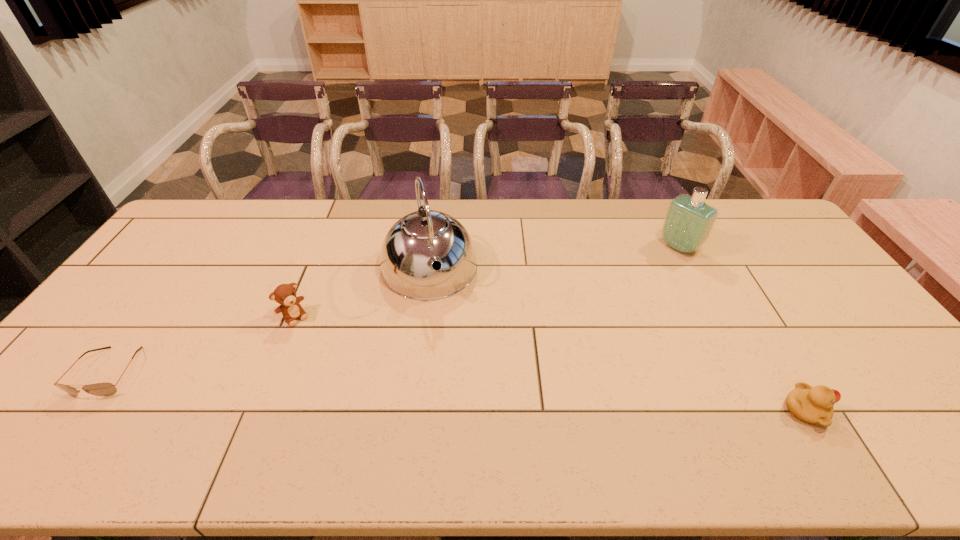
In order to click on free spot on the desktop that is between the shortest object and the second shortest object and is positioned from the spout of the tallest object in this screenshot , I will do `click(464, 392)`.

Find the location of `free spot on the desktop that is between the shortest object and the second shortest object and is positioned on the front label of the perfume`. free spot on the desktop that is between the shortest object and the second shortest object and is positioned on the front label of the perfume is located at coordinates (481, 393).

This screenshot has width=960, height=540. What are the coordinates of `free space on the desktop that is between the leftmost object and the second shortest object and is positioned on the face of the second object from left to right` in the screenshot? It's located at (355, 386).